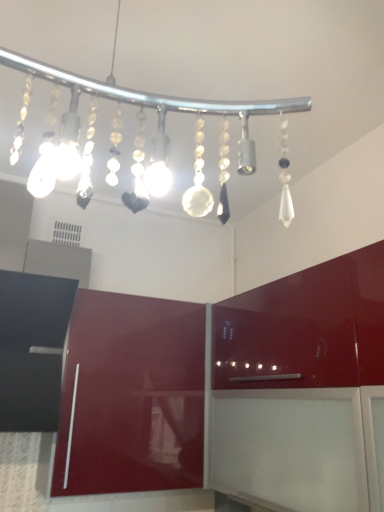
Question: In which direction should I rotate to look at glossy red cabinet at center, the first cabinetry positioned from the right?

Choices:
 (A) left
 (B) right

Answer: (B)

Question: From a real-world perspective, is clear glass chandelier at upper center physically below glossy burgundy cabinet at lower left, the 1th cabinetry in the left-to-right sequence?

Choices:
 (A) no
 (B) yes

Answer: (A)

Question: Can you confirm if clear glass chandelier at upper center is taller than glossy burgundy cabinet at lower left, which is counted as the 2th cabinetry, starting from the right?

Choices:
 (A) no
 (B) yes

Answer: (A)

Question: Is clear glass chandelier at upper center smaller than glossy burgundy cabinet at lower left, which is counted as the 2th cabinetry, starting from the right?

Choices:
 (A) yes
 (B) no

Answer: (A)

Question: Does clear glass chandelier at upper center appear on the left side of glossy burgundy cabinet at lower left, the 1th cabinetry in the left-to-right sequence?

Choices:
 (A) no
 (B) yes

Answer: (A)

Question: From a real-world perspective, does clear glass chandelier at upper center stand above glossy burgundy cabinet at lower left, the 1th cabinetry in the left-to-right sequence?

Choices:
 (A) yes
 (B) no

Answer: (A)

Question: Does clear glass chandelier at upper center have a greater width compared to glossy burgundy cabinet at lower left, the 1th cabinetry in the left-to-right sequence?

Choices:
 (A) yes
 (B) no

Answer: (A)

Question: Is clear glass chandelier at upper center shorter than glossy red cabinet at center, which is counted as the 2th cabinetry, starting from the left?

Choices:
 (A) yes
 (B) no

Answer: (A)

Question: Is the position of clear glass chandelier at upper center more distant than that of glossy red cabinet at center, which is counted as the 2th cabinetry, starting from the left?

Choices:
 (A) no
 (B) yes

Answer: (A)

Question: Can you confirm if clear glass chandelier at upper center is positioned to the left of glossy red cabinet at center, the first cabinetry positioned from the right?

Choices:
 (A) no
 (B) yes

Answer: (B)

Question: Is clear glass chandelier at upper center smaller than glossy red cabinet at center, the first cabinetry positioned from the right?

Choices:
 (A) no
 (B) yes

Answer: (B)

Question: Is clear glass chandelier at upper center directly adjacent to glossy red cabinet at center, which is counted as the 2th cabinetry, starting from the left?

Choices:
 (A) yes
 (B) no

Answer: (B)

Question: Is clear glass chandelier at upper center oriented away from glossy red cabinet at center, the first cabinetry positioned from the right?

Choices:
 (A) no
 (B) yes

Answer: (A)

Question: Can you confirm if glossy burgundy cabinet at lower left, which is counted as the 2th cabinetry, starting from the right, is taller than clear glass chandelier at upper center?

Choices:
 (A) yes
 (B) no

Answer: (A)